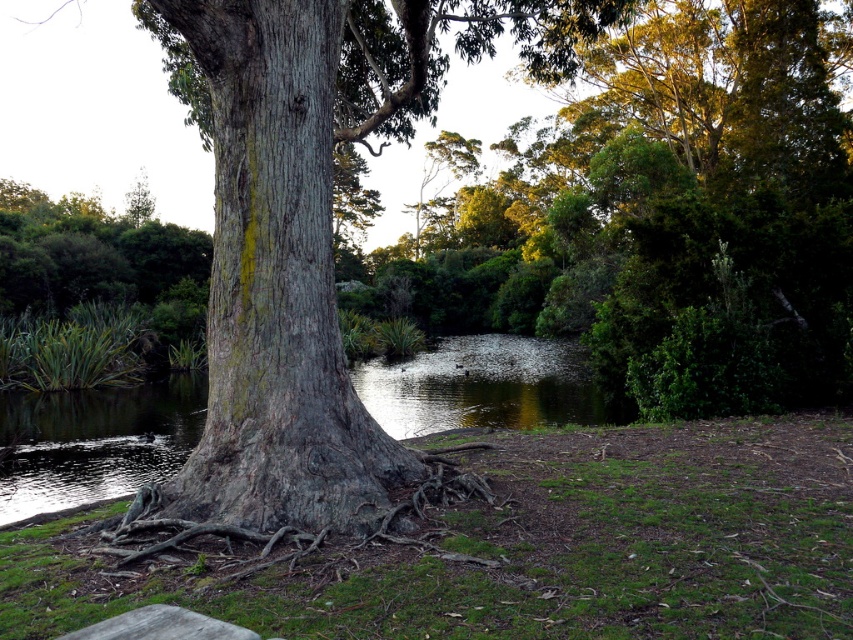
Who is shorter, greenish reflective water at center or smooth gray stone bench at lower left?

With less height is smooth gray stone bench at lower left.

The width and height of the screenshot is (853, 640). What do you see at coordinates (96, 442) in the screenshot?
I see `greenish reflective water at center` at bounding box center [96, 442].

What are the coordinates of `greenish reflective water at center` in the screenshot? It's located at (96, 442).

What do you see at coordinates (276, 284) in the screenshot? I see `gray rough bark tree trunk at center` at bounding box center [276, 284].

Which is more to the right, gray rough bark tree trunk at center or greenish reflective water at center?

Positioned to the right is gray rough bark tree trunk at center.

Who is more distant from viewer, (212, 346) or (21, 429)?

Point (21, 429)

The height and width of the screenshot is (640, 853). What are the coordinates of `gray rough bark tree trunk at center` in the screenshot? It's located at (276, 284).

Which is behind, point (334, 513) or point (187, 625)?

Positioned behind is point (334, 513).

Describe the element at coordinates (276, 284) in the screenshot. Image resolution: width=853 pixels, height=640 pixels. I see `gray rough bark tree trunk at center` at that location.

The width and height of the screenshot is (853, 640). Identify the location of gray rough bark tree trunk at center. (276, 284).